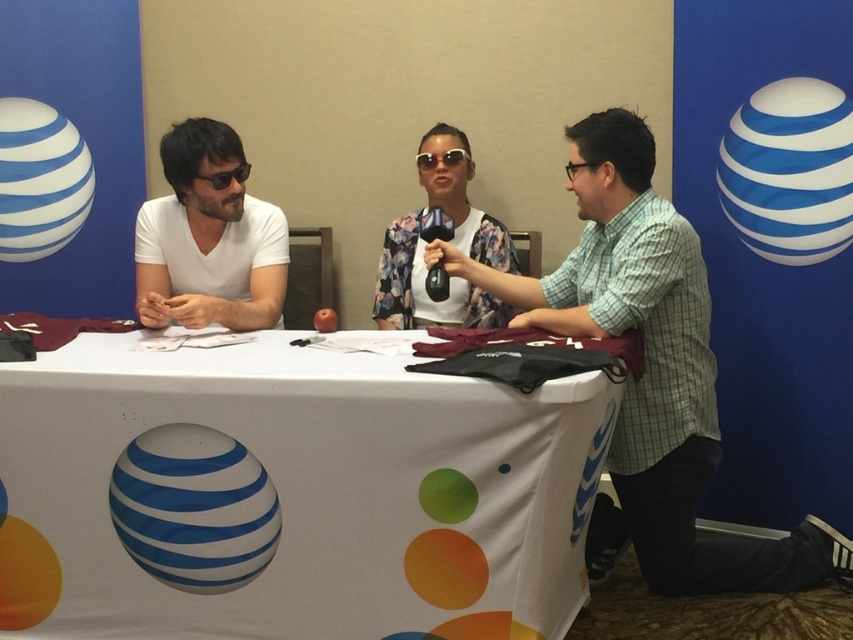
Between checkered fabric shirt at center and matte black sunglasses at left, which one is positioned lower?

checkered fabric shirt at center is lower down.

Is point (650, 502) closer to camera compared to point (207, 182)?

Yes, point (650, 502) is closer to viewer.

You are a GUI agent. You are given a task and a screenshot of the screen. Output one action in this format:
    pyautogui.click(x=<x>, y=<y>)
    Task: Click on the checkered fabric shirt at center
    
    Given the screenshot: What is the action you would take?
    pyautogui.click(x=648, y=371)

Which of these two, matte white shirt at left or matte black sunglasses at left, stands taller?

matte white shirt at left

In the scene shown: Between matte white shirt at left and matte black sunglasses at left, which one appears on the left side from the viewer's perspective?

matte white shirt at left is more to the left.

This screenshot has height=640, width=853. In order to click on matte white shirt at left in this screenshot , I will do `click(207, 237)`.

You are a GUI agent. You are given a task and a screenshot of the screen. Output one action in this format:
    pyautogui.click(x=<x>, y=<y>)
    Task: Click on the matte white shirt at left
    
    Given the screenshot: What is the action you would take?
    pos(207,237)

Can you confirm if white fabric table at center is positioned below matte white shirt at left?

Yes, white fabric table at center is below matte white shirt at left.

Is point (79, 346) less distant than point (210, 195)?

Yes, it is in front of point (210, 195).

Find the location of a particular element. This screenshot has width=853, height=640. white fabric table at center is located at coordinates (289, 496).